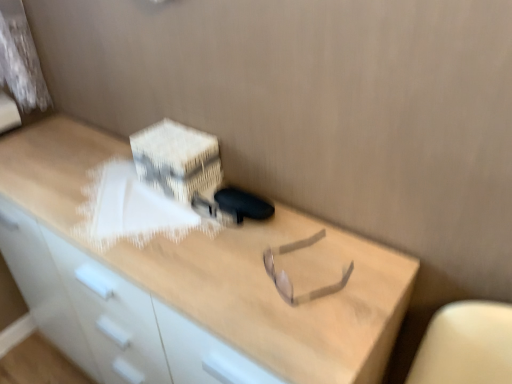
Question: Considering the relative positions of light wood desk at center and white cardboard box at upper center in the image provided, is light wood desk at center to the left of white cardboard box at upper center from the viewer's perspective?

Choices:
 (A) yes
 (B) no

Answer: (A)

Question: Would you consider light wood desk at center to be distant from white cardboard box at upper center?

Choices:
 (A) no
 (B) yes

Answer: (A)

Question: Does light wood desk at center turn towards white cardboard box at upper center?

Choices:
 (A) no
 (B) yes

Answer: (A)

Question: Is light wood desk at center thinner than white cardboard box at upper center?

Choices:
 (A) yes
 (B) no

Answer: (B)

Question: From a real-world perspective, is light wood desk at center positioned over white cardboard box at upper center based on gravity?

Choices:
 (A) no
 (B) yes

Answer: (A)

Question: Considering the relative sizes of light wood desk at center and white cardboard box at upper center in the image provided, is light wood desk at center taller than white cardboard box at upper center?

Choices:
 (A) no
 (B) yes

Answer: (B)

Question: Does white cardboard box at upper center have a larger size compared to light wood desk at center?

Choices:
 (A) no
 (B) yes

Answer: (A)

Question: Is white cardboard box at upper center at the right side of light wood desk at center?

Choices:
 (A) no
 (B) yes

Answer: (B)

Question: Can we say white cardboard box at upper center lies outside light wood desk at center?

Choices:
 (A) no
 (B) yes

Answer: (B)

Question: Is white cardboard box at upper center looking in the opposite direction of light wood desk at center?

Choices:
 (A) no
 (B) yes

Answer: (A)

Question: From the image's perspective, is white cardboard box at upper center beneath light wood desk at center?

Choices:
 (A) no
 (B) yes

Answer: (A)

Question: Could you tell me if white cardboard box at upper center is facing light wood desk at center?

Choices:
 (A) yes
 (B) no

Answer: (B)

Question: Considering the positions of light wood desk at center and white cardboard box at upper center in the image, is light wood desk at center taller or shorter than white cardboard box at upper center?

Choices:
 (A) short
 (B) tall

Answer: (B)